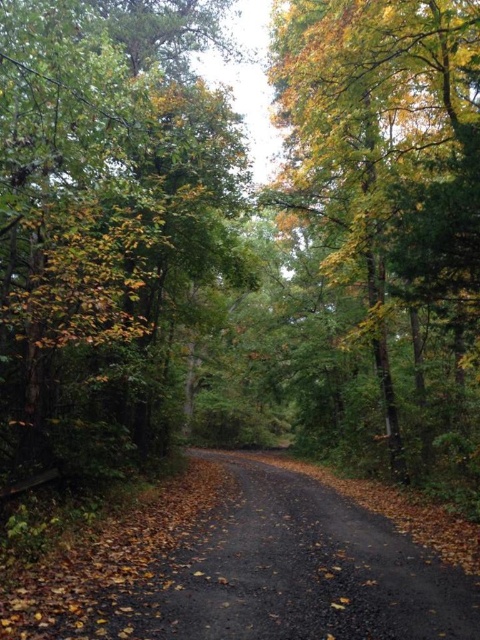
Between point (143, 173) and point (400, 547), which one is positioned in front?

Point (400, 547)

Does green matte tree at center appear over black asphalt road at center?

Yes, green matte tree at center is above black asphalt road at center.

Who is more forward, (x=134, y=321) or (x=321, y=496)?

Positioned in front is point (x=134, y=321).

Locate an element on the screen. The image size is (480, 640). green matte tree at center is located at coordinates (104, 220).

Can you confirm if green leafy tree at upper right is thinner than black asphalt road at center?

Incorrect, green leafy tree at upper right's width is not less than black asphalt road at center's.

Who is taller, green leafy tree at upper right or black asphalt road at center?

Standing taller between the two is green leafy tree at upper right.

Between point (445, 195) and point (336, 595), which one is positioned in front?

Point (336, 595) is more forward.

The height and width of the screenshot is (640, 480). I want to click on green leafy tree at upper right, so click(393, 195).

Is green matte tree at center to the left of green leafy tree at upper right from the viewer's perspective?

Indeed, green matte tree at center is positioned on the left side of green leafy tree at upper right.

Can you confirm if green matte tree at center is shorter than green leafy tree at upper right?

Correct, green matte tree at center is not as tall as green leafy tree at upper right.

Is point (169, 32) closer to camera compared to point (430, 260)?

No, it is not.

Where is `green matte tree at center`? green matte tree at center is located at coordinates [104, 220].